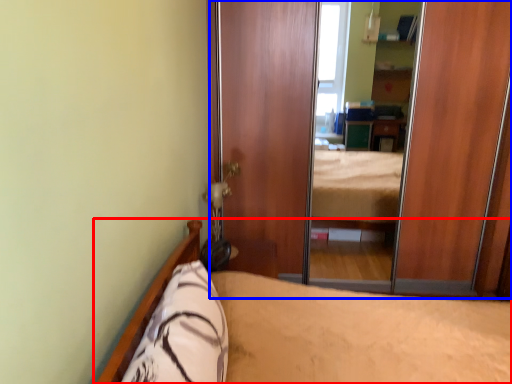
Question: Which object is closer to the camera taking this photo, bed (highlighted by a red box) or screen door (highlighted by a blue box)?

Choices:
 (A) bed
 (B) screen door

Answer: (A)